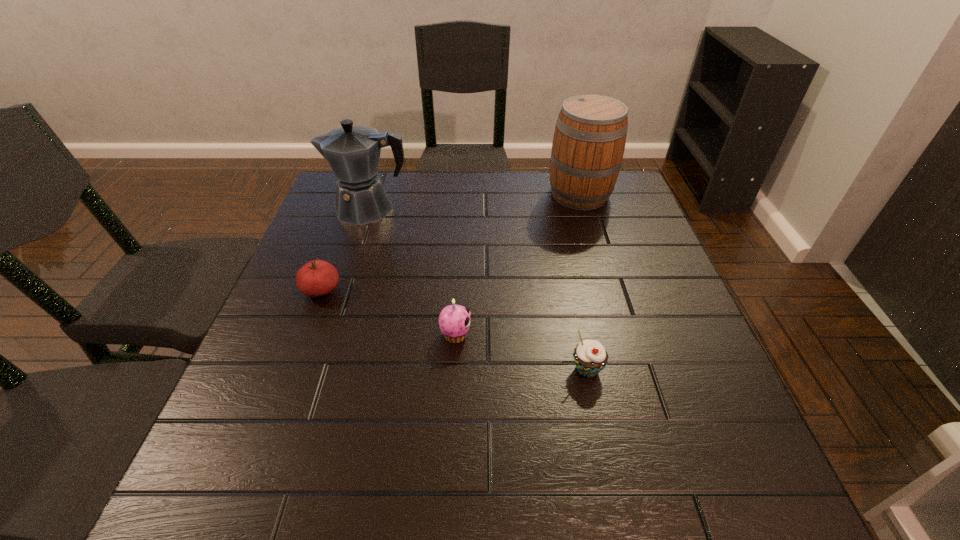
At what (x,y) coordinates should I click in order to perform the action: click on free space between the right cupcake and the coffeepot. Please return your answer as a coordinate pair (x, y). This screenshot has width=960, height=540. Looking at the image, I should click on (478, 289).

Where is `vacant space in between the cider and the nearest object`? vacant space in between the cider and the nearest object is located at coordinates (584, 282).

Locate which object is the fourth closest to the third nearest object. Please provide its 2D coordinates. Your answer should be formatted as a tuple, i.e. [(x, y)], where the tuple contains the x and y coordinates of a point satisfying the conditions above.

[(589, 140)]

Where is `object that can be found as the closest to the tomato`? object that can be found as the closest to the tomato is located at coordinates (353, 152).

In order to click on free location that satisfies the following two spatial constraints: 1. at the spout of the coffeepot; 2. on the front side of the third farthest object in this screenshot , I will do `click(343, 290)`.

Image resolution: width=960 pixels, height=540 pixels. What are the coordinates of `free space that satisfies the following two spatial constraints: 1. on the front side of the tomato; 2. on the right side of the nearest object` in the screenshot? It's located at (292, 369).

The width and height of the screenshot is (960, 540). I want to click on free space in the image that satisfies the following two spatial constraints: 1. on the face of the nearer cupcake; 2. on the left side of the farther cupcake, so click(454, 369).